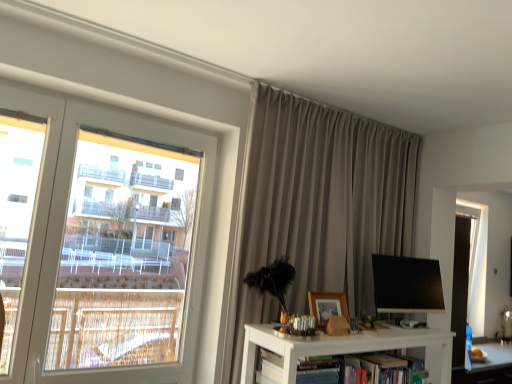
Question: Considering the positions of point (380, 273) and point (269, 307), is point (380, 273) closer or farther from the camera than point (269, 307)?

Choices:
 (A) farther
 (B) closer

Answer: (A)

Question: Choose the correct answer: Is black glossy monitor at center inside matte gray curtain at upper center or outside it?

Choices:
 (A) inside
 (B) outside

Answer: (B)

Question: Estimate the real-world distances between objects in this image. Which object is farther from the black glossy monitor at center?

Choices:
 (A) matte gray curtain at upper center
 (B) hardcover book at center
 (C) white plastic window at left
 (D) wooden picture frame at center

Answer: (C)

Question: Which object is the closest to the wooden picture frame at center?

Choices:
 (A) white plastic window at left
 (B) hardcover book at center
 (C) black glossy monitor at center
 (D) matte gray curtain at upper center

Answer: (B)